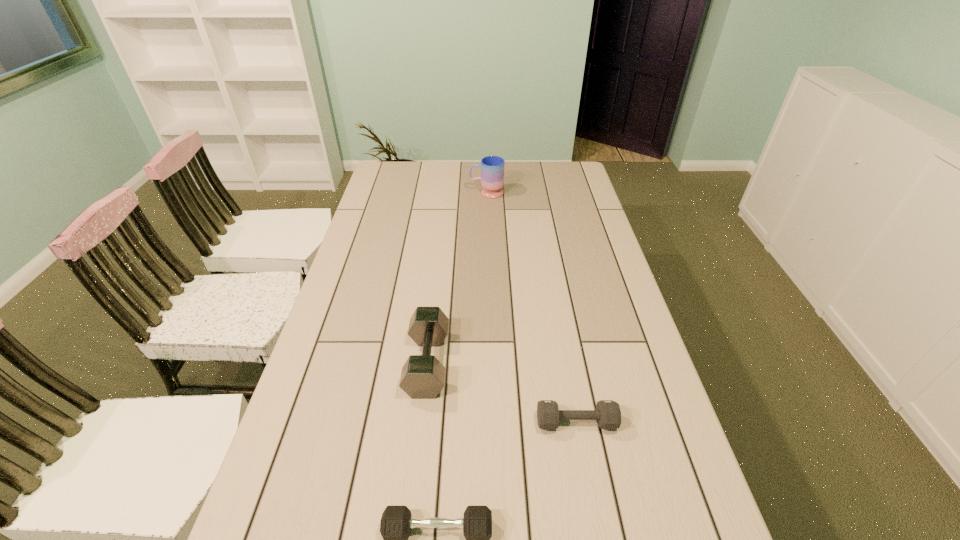
This screenshot has height=540, width=960. Find the location of `the farthest object`. the farthest object is located at coordinates (492, 167).

Locate an element on the screen. the tallest object is located at coordinates (492, 167).

You are a GUI agent. You are given a task and a screenshot of the screen. Output one action in this format:
    pyautogui.click(x=<x>, y=<y>)
    Task: Click on the tallest dumbbell
    
    Given the screenshot: What is the action you would take?
    pyautogui.click(x=422, y=377)

What are the coordinates of `the third shortest object` in the screenshot? It's located at (422, 377).

Find the location of a particular element. the rightmost dumbbell is located at coordinates (608, 414).

Where is `the second nearest object`? The width and height of the screenshot is (960, 540). the second nearest object is located at coordinates (608, 414).

The height and width of the screenshot is (540, 960). In order to click on vacant area located 0.320m on the side of the tallest object with the handle in this screenshot , I will do [392, 193].

At what (x,y) coordinates should I click in order to perform the action: click on vacant space located 0.300m on the side of the tallest object with the handle. Please return your answer as a coordinate pair (x, y). Image resolution: width=960 pixels, height=540 pixels. Looking at the image, I should click on (396, 193).

Locate an element on the screen. The width and height of the screenshot is (960, 540). free location located on the side of the tallest object with the handle is located at coordinates (445, 193).

Where is `free space located on the back of the second farthest object`? The width and height of the screenshot is (960, 540). free space located on the back of the second farthest object is located at coordinates (435, 293).